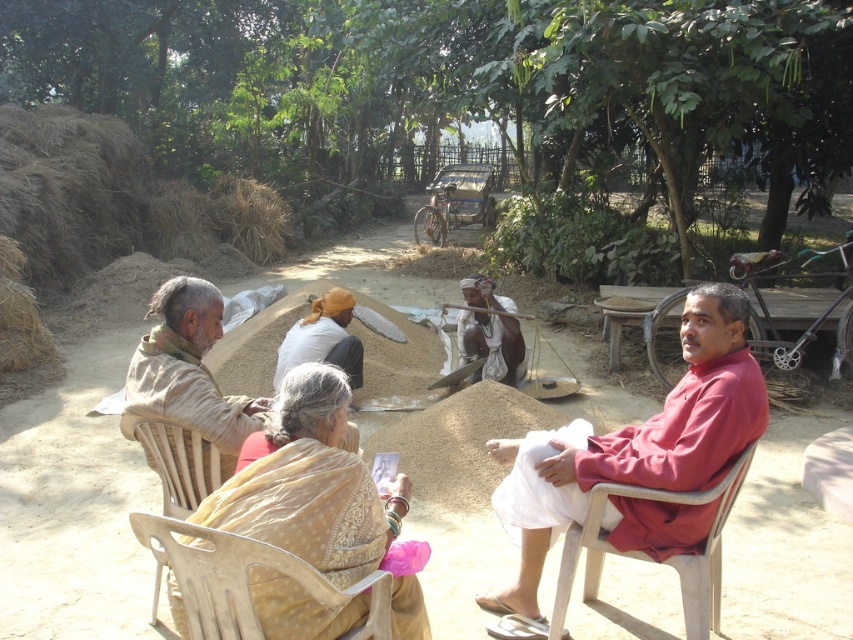
Question: Which object is the farthest from the beige plastic chair at lower center?

Choices:
 (A) wooden chair at left
 (B) wooden chair at lower left
 (C) matte red shirt at center

Answer: (C)

Question: Which is nearer to the white cotton cloth at center?

Choices:
 (A) beige plastic chair at lower center
 (B) wooden chair at lower right

Answer: (B)

Question: Is wooden chair at left in front of white cotton cloth at center?

Choices:
 (A) yes
 (B) no

Answer: (A)

Question: Observing the image, what is the correct spatial positioning of beige fabric headscarf at left in reference to light beige fabric at center?

Choices:
 (A) above
 (B) below

Answer: (B)

Question: Which object is farther from the camera taking this photo?

Choices:
 (A) light beige fabric at center
 (B) white cotton cloth at center
 (C) wooden chair at left

Answer: (B)

Question: Is brown dirt field at center thinner than beige fabric headscarf at left?

Choices:
 (A) no
 (B) yes

Answer: (A)